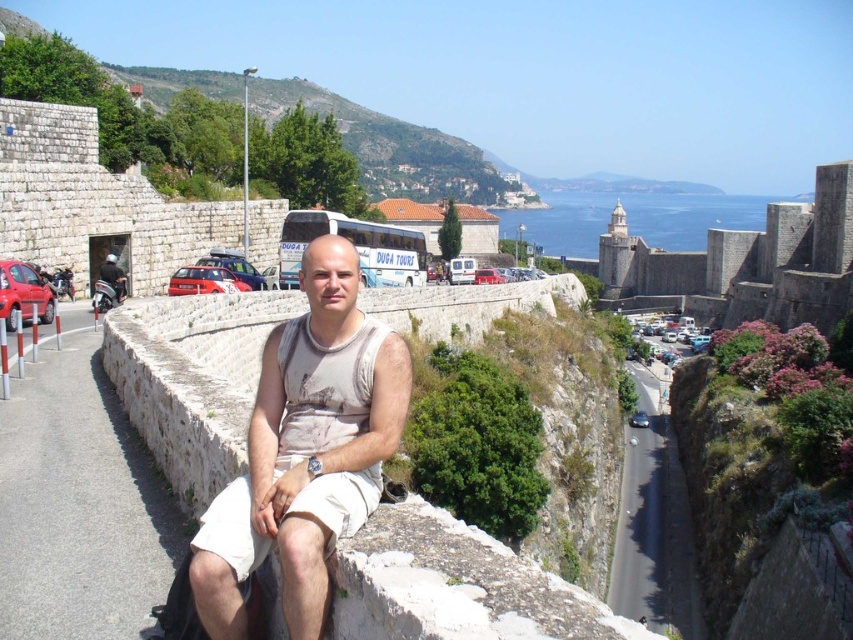
Question: Which object appears farthest from the camera in this image?

Choices:
 (A) stone wall at upper right
 (B) white cotton tank top at center
 (C) white stone ledge at center

Answer: (A)

Question: Which object is the farthest from the stone wall at upper right?

Choices:
 (A) white cotton tank top at center
 (B) white stone ledge at center

Answer: (A)

Question: Is white stone ledge at center to the right of white cotton tank top at center from the viewer's perspective?

Choices:
 (A) yes
 (B) no

Answer: (A)

Question: Can you confirm if white stone ledge at center is positioned below white cotton tank top at center?

Choices:
 (A) no
 (B) yes

Answer: (A)

Question: Which point is farther to the camera?

Choices:
 (A) white stone ledge at center
 (B) stone wall at upper right

Answer: (B)

Question: Can you confirm if white stone ledge at center is positioned above stone wall at upper right?

Choices:
 (A) yes
 (B) no

Answer: (B)